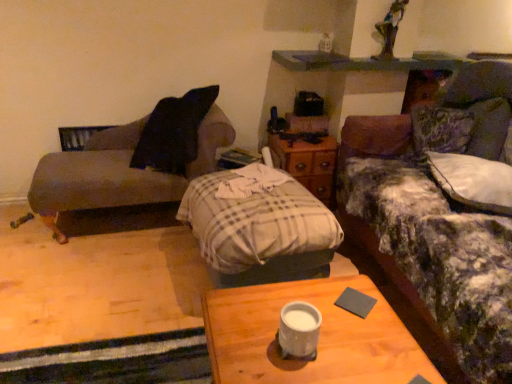
What do you see at coordinates (473, 181) in the screenshot? This screenshot has height=384, width=512. I see `fluffy white pillow at right` at bounding box center [473, 181].

Locate an element on the screen. This screenshot has width=512, height=384. gray matte pad at center is located at coordinates (355, 302).

Identify the location of fluffy fabric couch at right, marked as the 1th studio couch in a right-to-left arrangement. The width and height of the screenshot is (512, 384). (445, 212).

Measure the distance between fluffy fabric couch at right, marked as the 1th studio couch in a right-to-left arrangement, and camera.

The depth of fluffy fabric couch at right, marked as the 1th studio couch in a right-to-left arrangement, is 1.28 meters.

Identify the location of matte brown couch at left, which is the 1th studio couch from left to right. (134, 160).

Which object is closer to the camera, fluffy white pillow at right or white matte coffee cup at center?

white matte coffee cup at center is closer to the camera.

How many degrees apart are the facing directions of fluffy white pillow at right and white matte coffee cup at center?

The angle between the facing direction of fluffy white pillow at right and the facing direction of white matte coffee cup at center is 13.7 degrees.

Is fluffy white pillow at right far from white matte coffee cup at center?

fluffy white pillow at right is positioned a significant distance from white matte coffee cup at center.

Is fluffy white pillow at right completely or partially outside of white matte coffee cup at center?

That's correct, fluffy white pillow at right is outside of white matte coffee cup at center.

Considering the sizes of objects fluffy fabric couch at right, the 2th studio couch viewed from the left, and wooden nightstand at center in the image provided, who is thinner, fluffy fabric couch at right, the 2th studio couch viewed from the left, or wooden nightstand at center?

wooden nightstand at center.

In the image, is fluffy fabric couch at right, the 2th studio couch viewed from the left, positioned in front of or behind wooden nightstand at center?

Clearly, fluffy fabric couch at right, the 2th studio couch viewed from the left, is in front of wooden nightstand at center.

From a real-world perspective, is fluffy fabric couch at right, the 2th studio couch viewed from the left, positioned above or below wooden nightstand at center?

From a real-world perspective, fluffy fabric couch at right, the 2th studio couch viewed from the left, is physically above wooden nightstand at center.

Measure the distance from fluffy fabric couch at right, the 2th studio couch viewed from the left, to wooden nightstand at center.

The distance of fluffy fabric couch at right, the 2th studio couch viewed from the left, from wooden nightstand at center is 22.71 inches.

From the image's perspective, between fluffy fabric couch at right, the 2th studio couch viewed from the left, and fluffy white pillow at right, which one is located above?

fluffy white pillow at right, from the image's perspective.

How distant is fluffy fabric couch at right, the 2th studio couch viewed from the left, from fluffy white pillow at right?

They are 7.15 inches apart.

Considering the relative sizes of fluffy fabric couch at right, marked as the 1th studio couch in a right-to-left arrangement, and fluffy white pillow at right in the image provided, is fluffy fabric couch at right, marked as the 1th studio couch in a right-to-left arrangement, thinner than fluffy white pillow at right?

Incorrect, the width of fluffy fabric couch at right, marked as the 1th studio couch in a right-to-left arrangement, is not less than that of fluffy white pillow at right.

You are a GUI agent. You are given a task and a screenshot of the screen. Output one action in this format:
    pyautogui.click(x=<x>, y=<y>)
    Task: Click on the studio couch lying on the right of fluffy white pillow at right
    
    Given the screenshot: What is the action you would take?
    pyautogui.click(x=445, y=212)

Who is shorter, wooden desk at center or gray matte pad at center?

Standing shorter between the two is gray matte pad at center.

Identify the location of desk below the gray matte pad at center (from a real-world perspective). The image size is (512, 384). (319, 337).

Does point (305, 378) appear closer or farther from the camera than point (341, 298)?

Point (305, 378).

Who is bigger, wooden nightstand at center or fluffy fabric couch at right, marked as the 1th studio couch in a right-to-left arrangement?

fluffy fabric couch at right, marked as the 1th studio couch in a right-to-left arrangement, is bigger.

Consider the image. Considering the relative sizes of wooden nightstand at center and fluffy fabric couch at right, the 2th studio couch viewed from the left, in the image provided, is wooden nightstand at center shorter than fluffy fabric couch at right, the 2th studio couch viewed from the left,?

Indeed, wooden nightstand at center has a lesser height compared to fluffy fabric couch at right, the 2th studio couch viewed from the left.

From a real-world perspective, is wooden nightstand at center positioned above or below fluffy fabric couch at right, the 2th studio couch viewed from the left?

In terms of real-world spatial position, wooden nightstand at center is below fluffy fabric couch at right, the 2th studio couch viewed from the left.

Where is `nightstand that appears on the left of fluffy fabric couch at right, the 2th studio couch viewed from the left`? nightstand that appears on the left of fluffy fabric couch at right, the 2th studio couch viewed from the left is located at coordinates (308, 164).

Considering their positions, is fluffy white pillow at right located in front of or behind matte brown couch at left, which is the 1th studio couch from left to right?

fluffy white pillow at right is positioned closer to the viewer than matte brown couch at left, which is the 1th studio couch from left to right.

Which is in front, point (458, 161) or point (160, 148)?

The point (458, 161) is in front.

Could matte brown couch at left, which is the second studio couch in right-to-left order, be considered to be inside fluffy white pillow at right?

Definitely not — matte brown couch at left, which is the second studio couch in right-to-left order, is not inside fluffy white pillow at right.

From a real-world perspective, is fluffy white pillow at right on matte brown couch at left, which is the 1th studio couch from left to right?

Yes, from a real-world perspective, fluffy white pillow at right is above matte brown couch at left, which is the 1th studio couch from left to right.

Who is taller, matte brown couch at left, which is the 1th studio couch from left to right, or fluffy white pillow at right?

matte brown couch at left, which is the 1th studio couch from left to right.

From a real-world perspective, is matte brown couch at left, which is the 1th studio couch from left to right, positioned above or below fluffy white pillow at right?

Clearly, from a real-world perspective, matte brown couch at left, which is the 1th studio couch from left to right, is below fluffy white pillow at right.

Which is correct: matte brown couch at left, which is the second studio couch in right-to-left order, is inside fluffy white pillow at right, or outside of it?

matte brown couch at left, which is the second studio couch in right-to-left order, exists outside the volume of fluffy white pillow at right.

Is point (192, 169) closer or farther from the camera than point (473, 170)?

Point (192, 169) is farther from the camera than point (473, 170).

Find the location of a particular element. This screenshot has height=384, width=512. pillow above the white matte coffee cup at center (from a real-world perspective) is located at coordinates (473, 181).

Find the location of a particular element. Image resolution: width=512 pixels, height=384 pixels. studio couch that is the 2nd object located below the wooden nightstand at center (from the image's perspective) is located at coordinates (445, 212).

Looking at the image, which one is located closer to matte brown couch at left, which is the 1th studio couch from left to right, wooden desk at center or gray matte pad at center?

Among the two, wooden desk at center is located nearer to matte brown couch at left, which is the 1th studio couch from left to right.

When comparing their distances from fluffy white pillow at right, does wooden desk at center or wooden nightstand at center seem further?

The object further to fluffy white pillow at right is wooden desk at center.

Estimate the real-world distances between objects in this image. Which object is further from gray matte pad at center, fluffy white pillow at right or white matte coffee cup at center?

fluffy white pillow at right is further to gray matte pad at center.

Considering their positions, is white matte coffee cup at center positioned closer to wooden desk at center than fluffy fabric couch at right, marked as the 1th studio couch in a right-to-left arrangement?

white matte coffee cup at center lies closer to wooden desk at center than the other object.

When comparing their distances from wooden nightstand at center, does plaid fabric pillow at center or white matte coffee cup at center seem closer?

plaid fabric pillow at center is closer to wooden nightstand at center.

Looking at this image, when comparing their distances from wooden desk at center, does matte brown couch at left, which is the 1th studio couch from left to right, or fluffy white pillow at right seem further?

matte brown couch at left, which is the 1th studio couch from left to right.

When comparing their distances from gray matte pad at center, does fluffy white pillow at right or plaid fabric pillow at center seem further?

Based on the image, fluffy white pillow at right appears to be further to gray matte pad at center.

Considering their positions, is wooden nightstand at center positioned further to matte brown couch at left, which is the 1th studio couch from left to right, than gray matte pad at center?

gray matte pad at center.

Image resolution: width=512 pixels, height=384 pixels. Find the location of `pillow between matte brown couch at left, which is the 1th studio couch from left to right, and fluffy fabric couch at right, the 2th studio couch viewed from the left`. pillow between matte brown couch at left, which is the 1th studio couch from left to right, and fluffy fabric couch at right, the 2th studio couch viewed from the left is located at coordinates (473, 181).

Find the location of `pillow between plaid fabric pillow at center and fluffy fabric couch at right, the 2th studio couch viewed from the left`. pillow between plaid fabric pillow at center and fluffy fabric couch at right, the 2th studio couch viewed from the left is located at coordinates (473, 181).

Identify the location of nightstand located between matte brown couch at left, which is the second studio couch in right-to-left order, and fluffy fabric couch at right, marked as the 1th studio couch in a right-to-left arrangement, in the left-right direction. Image resolution: width=512 pixels, height=384 pixels. (308, 164).

In order to click on desk between matte brown couch at left, which is the 1th studio couch from left to right, and gray matte pad at center in this screenshot , I will do `click(319, 337)`.